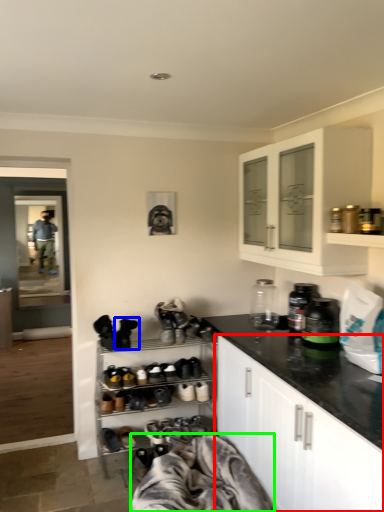
Question: Considering the real-world distances, which object is closest to cabinetry (highlighted by a red box)? footwear (highlighted by a blue box) or blanket (highlighted by a green box).

Choices:
 (A) footwear
 (B) blanket

Answer: (B)